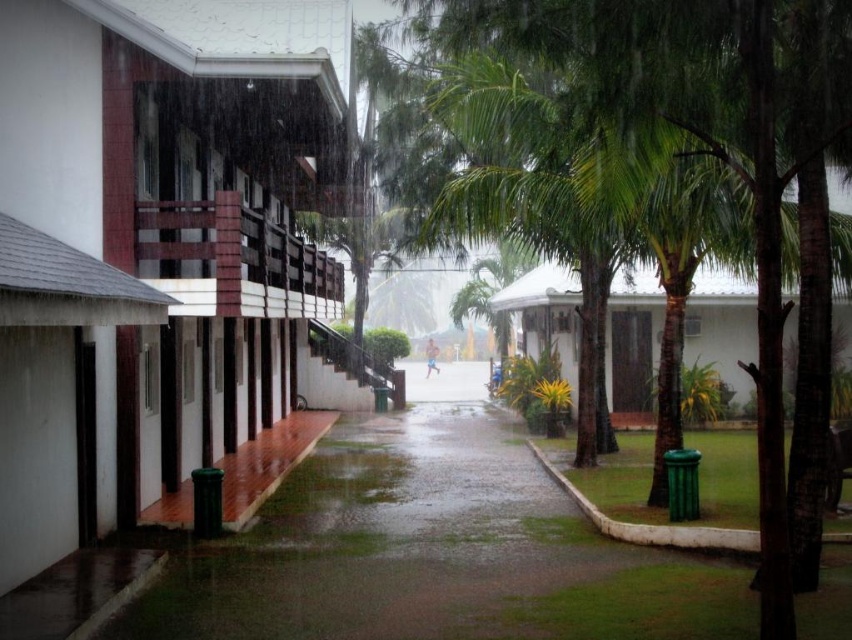
You are standing in the rainy scene and want to take a photo of both the point at coordinates (663, 44) and the point at coordinates (426, 376). Which point should you focus on first to ensure both are in focus?

You should focus on the point at coordinates (663, 44) first because it is closer to the camera than the point at coordinates (426, 376). This way, the depth of field will likely cover both points when focusing on the closer one.

Looking at this image, you are standing at the edge of the walkway in the rainy scene. You see a green leafy tree at center and a smooth skin runner at center. Which object is positioned to the right of the other?

The green leafy tree at center is to the right of the smooth skin runner at center.